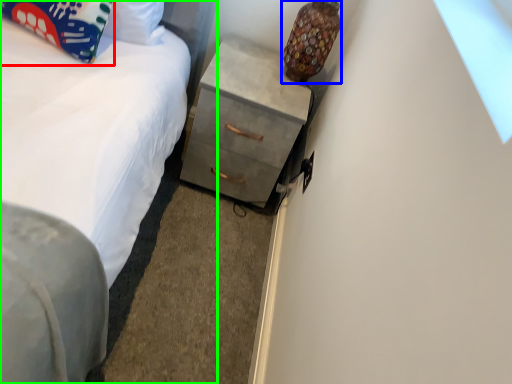
Question: Based on their relative distances, which object is farther from pillow (highlighted by a red box)? Choose from lamp (highlighted by a blue box) and bed (highlighted by a green box).

Choices:
 (A) lamp
 (B) bed

Answer: (A)